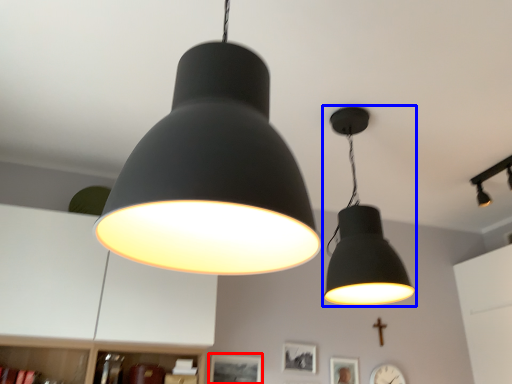
Question: Which point is closer to the camera, picture frame (highlighted by a red box) or lamp (highlighted by a blue box)?

Choices:
 (A) picture frame
 (B) lamp

Answer: (B)